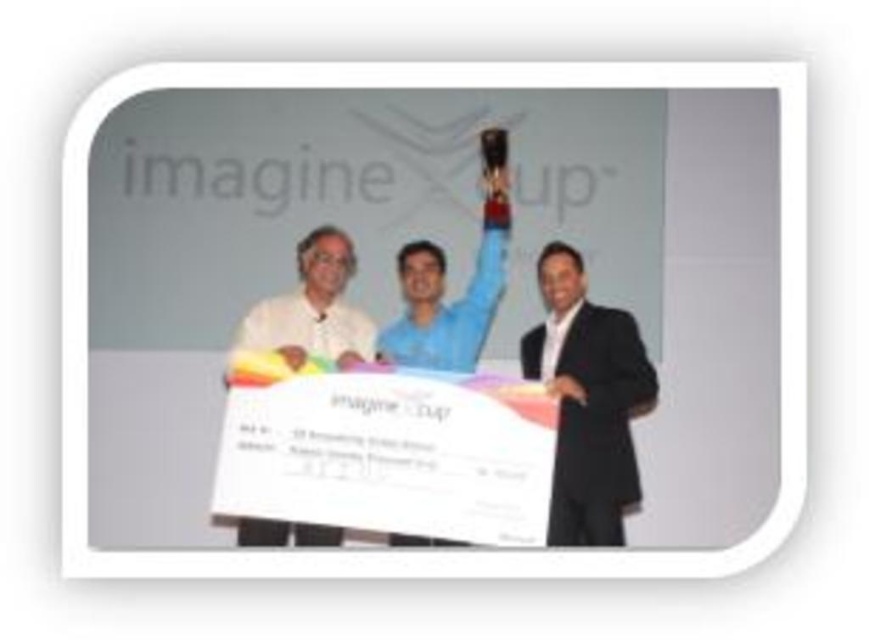
You are a photographer at the event and need to capture a photo of the black suit at right and white matte shirt at center. The camera you are using has a maximum focus range of 36 inches. Will you be able to take a clear photo of both subjects without moving the camera?

The black suit at right and white matte shirt at center are 38.28 inches apart from each other. Since the camera can only focus within 36 inches, the distance between them exceeds the focus range. Therefore, you cannot take a clear photo of both subjects without moving the camera.

In the image of the Imagine Cup event, there are two people dressed in black suit at right and white matte shirt at center. Which one is positioned more to the right side of the image?

The black suit at right is positioned to the right of the white matte shirt at center, so the black suit at right is more to the right side of the image.

Looking at this image, you are standing in the audience looking at the stage. There are two points marked on the stage. The first point is located at coordinate point (565, 515) and the second point is at (365, 321). Which point is closer to you?

The point at coordinate point (565, 515) is closer to you than the point at (365, 321).